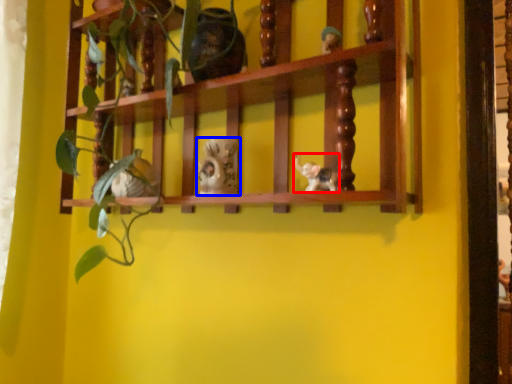
Question: Which object appears closest to the camera in this image, toy (highlighted by a red box) or toy (highlighted by a blue box)?

Choices:
 (A) toy
 (B) toy

Answer: (A)